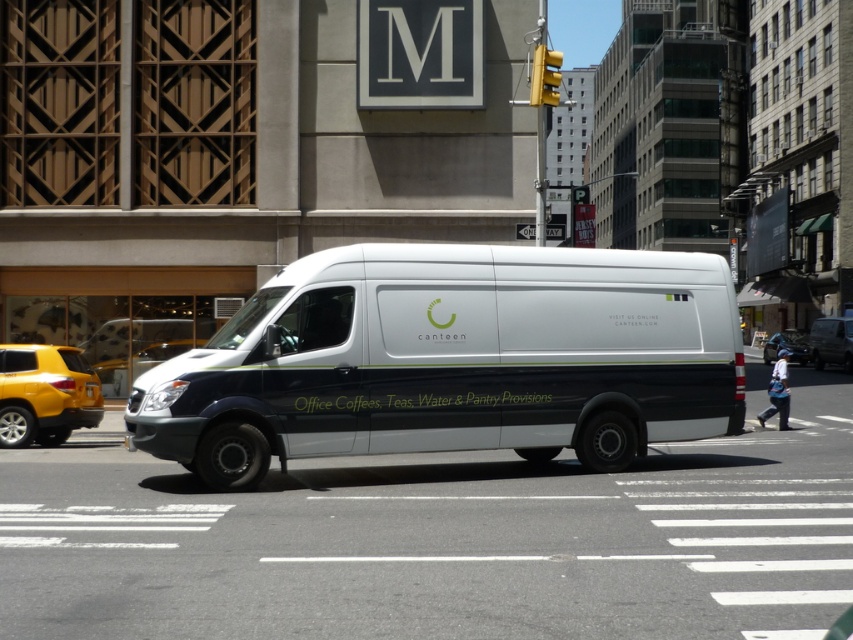
Question: Considering the real-world distances, which object is farthest from the yellow matte suv at left?

Choices:
 (A) metallic silver van at center
 (B) white matte van at center

Answer: (A)

Question: Does white matte van at center appear on the left side of blue fabric car at center?

Choices:
 (A) no
 (B) yes

Answer: (B)

Question: Is yellow matte suv at left further to camera compared to blue fabric car at center?

Choices:
 (A) no
 (B) yes

Answer: (A)

Question: Does white matte van at center appear on the right side of metallic silver van at center?

Choices:
 (A) yes
 (B) no

Answer: (B)

Question: Which object is positioned closest to the blue fabric car at center?

Choices:
 (A) white matte van at center
 (B) yellow matte suv at left
 (C) metallic silver van at center

Answer: (C)

Question: Based on their relative distances, which object is farther from the blue fabric car at center?

Choices:
 (A) yellow matte suv at left
 (B) metallic silver van at center
 (C) white matte van at center

Answer: (C)